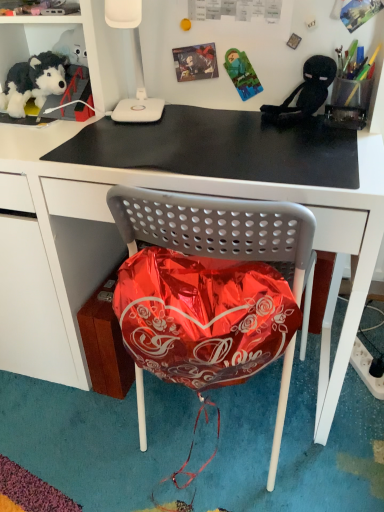
Locate an element on the screen. The width and height of the screenshot is (384, 512). vacant space situated on the left part of metallic red balloon at center is located at coordinates (76, 428).